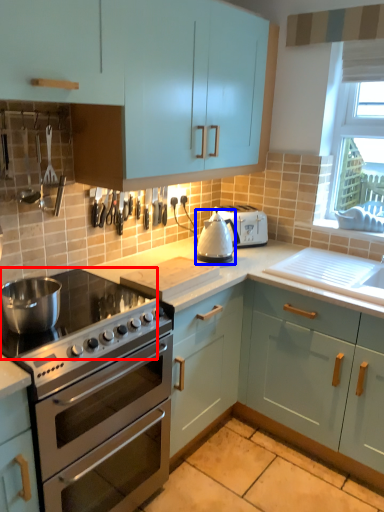
Question: Which object appears closest to the camera in this image, gas stove (highlighted by a red box) or appliance (highlighted by a blue box)?

Choices:
 (A) gas stove
 (B) appliance

Answer: (A)